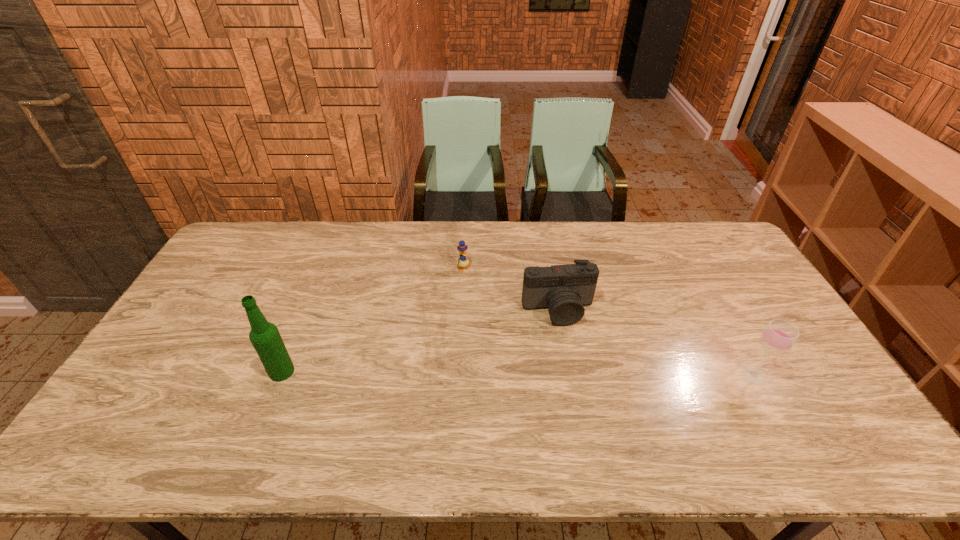
At what (x,y) coordinates should I click in order to perform the action: click on vacant space on the desktop that is between the beer bottle and the rightmost object and is positioned on the face of the second object from left to right, where the monocle is placed. Please return your answer as a coordinate pair (x, y). The width and height of the screenshot is (960, 540). Looking at the image, I should click on click(581, 374).

The image size is (960, 540). Find the location of `vacant spot on the desktop that is between the beer bottle and the second tallest object and is positioned at the lens of the third object from left to right`. vacant spot on the desktop that is between the beer bottle and the second tallest object and is positioned at the lens of the third object from left to right is located at coordinates (579, 374).